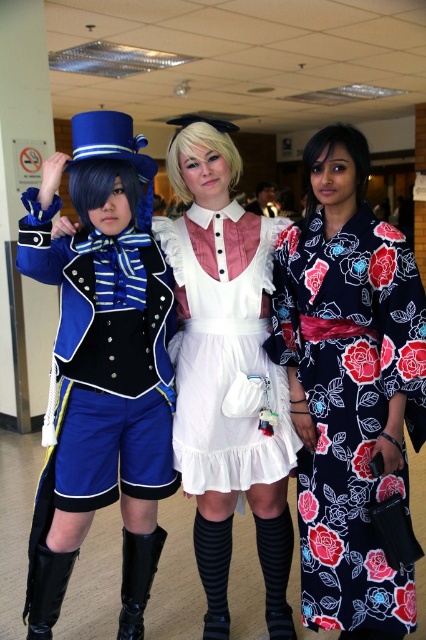
In the scene shown: Who is shorter, white satin dress at center or black leather boot at lower center?

black leather boot at lower center

Is white satin dress at center to the right of black leather boot at lower center from the viewer's perspective?

Indeed, white satin dress at center is positioned on the right side of black leather boot at lower center.

Does point (218, 364) come in front of point (137, 580)?

Yes, point (218, 364) is in front of point (137, 580).

Identify the location of white satin dress at center. This screenshot has width=426, height=640. (224, 362).

Is floral silk kimono at right shorter than black leather boot at lower left?

Incorrect, floral silk kimono at right's height does not fall short of black leather boot at lower left's.

Measure the distance from floral silk kimono at right to black leather boot at lower left.

floral silk kimono at right is 38.75 inches from black leather boot at lower left.

This screenshot has width=426, height=640. Find the location of `floral silk kimono at right`. floral silk kimono at right is located at coordinates (351, 394).

You are a GUI agent. You are given a task and a screenshot of the screen. Output one action in this format:
    pyautogui.click(x=<x>, y=<y>)
    Task: Click on the floral silk kimono at right
    This screenshot has width=426, height=640.
    Given the screenshot: What is the action you would take?
    pyautogui.click(x=351, y=394)

Does floral silk kimono at right appear on the left side of black leather boot at lower center?

Incorrect, floral silk kimono at right is not on the left side of black leather boot at lower center.

Who is lower down, floral silk kimono at right or black leather boot at lower center?

black leather boot at lower center

Between point (397, 557) and point (134, 625), which one is positioned behind?

Positioned behind is point (134, 625).

Find the location of a particular element. The width and height of the screenshot is (426, 640). floral silk kimono at right is located at coordinates [351, 394].